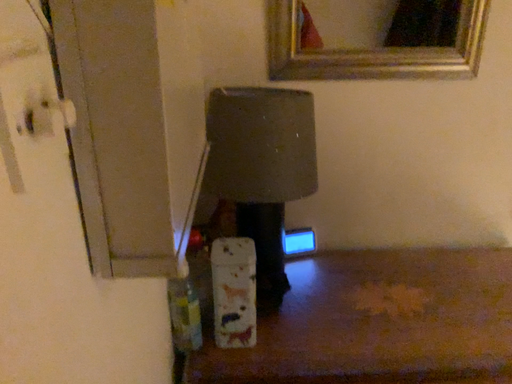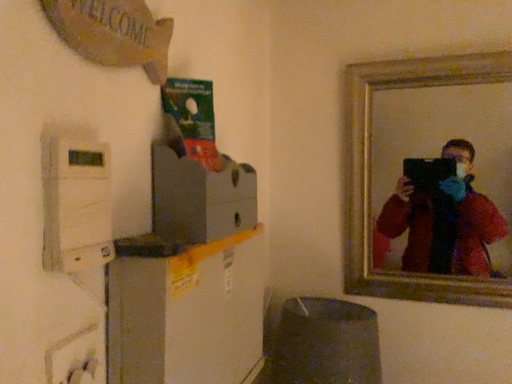
Question: How did the camera likely rotate when shooting the video?

Choices:
 (A) rotated right
 (B) rotated left

Answer: (B)